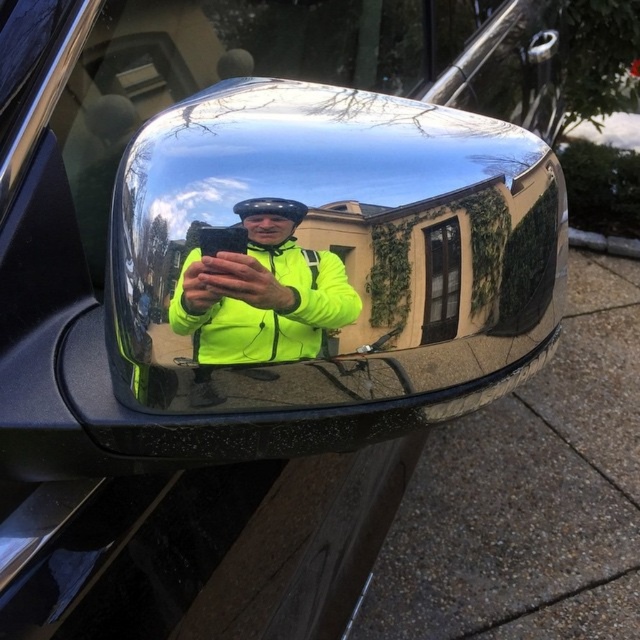
You are a delivery driver who just arrived at a location. You need to check if the neon yellow jacket at center and the clear glass window at center in the reflection are close enough to be captured in a single photo without moving the camera. The minimum distance your camera can focus on two objects in the same frame is 3 inches. Can you take the photo?

The neon yellow jacket at center and clear glass window at center are 3.86 inches apart from each other. Since the minimum focus distance your camera requires is 3 inches, the 3.86 inches exceeds this threshold, so you cannot capture both in a single photo without moving the camera.

You are standing in front of the vehicle mirror and want to locate two points in the reflection. The first point is at coordinates point (508,147) and the second is at point (436,332). Which point is closer to you in the reflection?

Point (436,332) is closer to you in the reflection because in the reflection, objects that are physically closer to the mirror appear closer in the reflection. Since point (508,147) is behind point (436,332), the latter is nearer to the mirror and thus closer in the reflection.